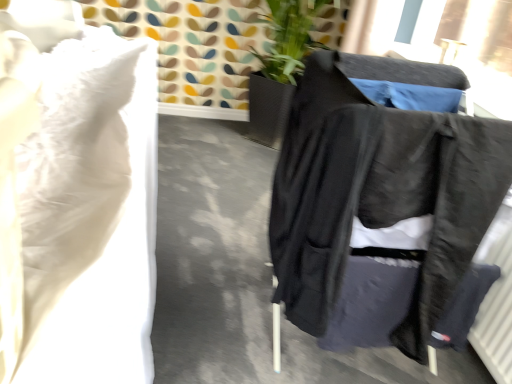
This screenshot has height=384, width=512. What are the coordinates of `vacant space positioned to the left of black fabric jacket at right` in the screenshot? It's located at (206, 280).